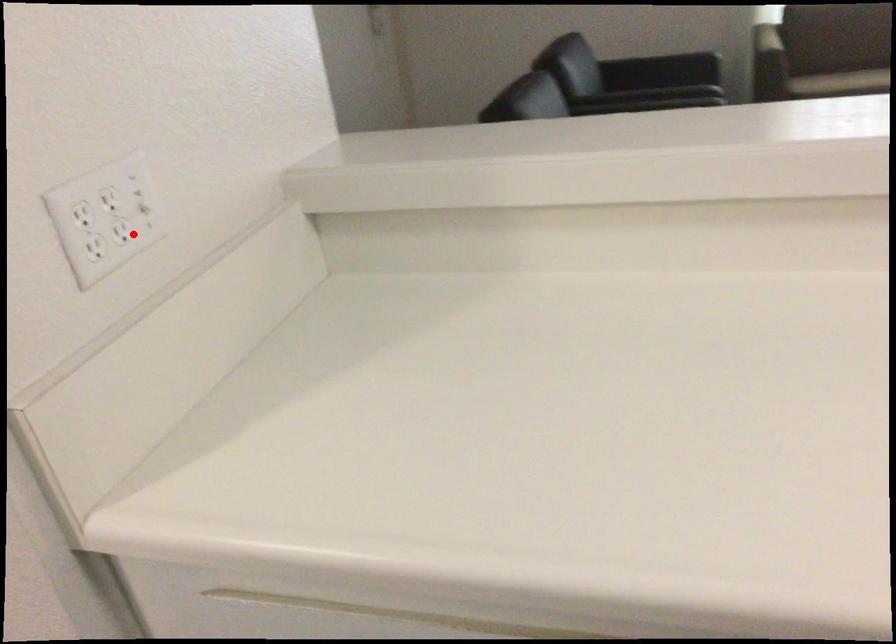
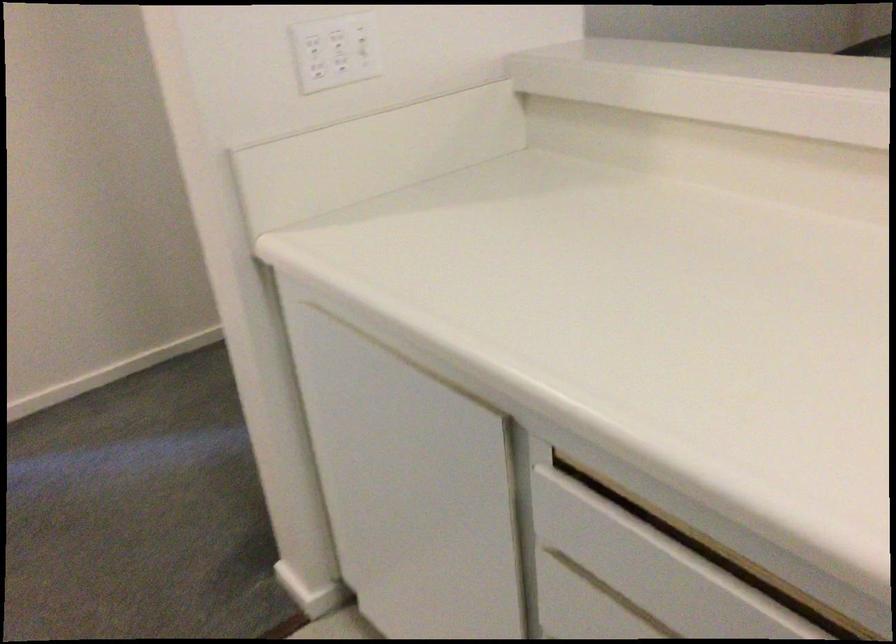
Question: A red point is marked in image1. In image2, is the corresponding 3D point closer to the camera or farther? Reply with the corresponding letter.

Choices:
 (A) The corresponding 3D point is closer.
 (B) The corresponding 3D point is farther.

Answer: (B)